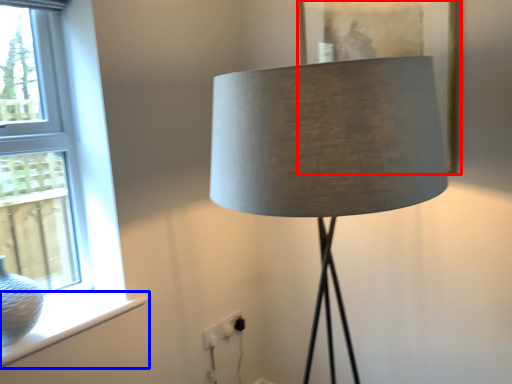
Question: Which point is further to the camera, picture frame (highlighted by a red box) or window sill (highlighted by a blue box)?

Choices:
 (A) picture frame
 (B) window sill

Answer: (A)